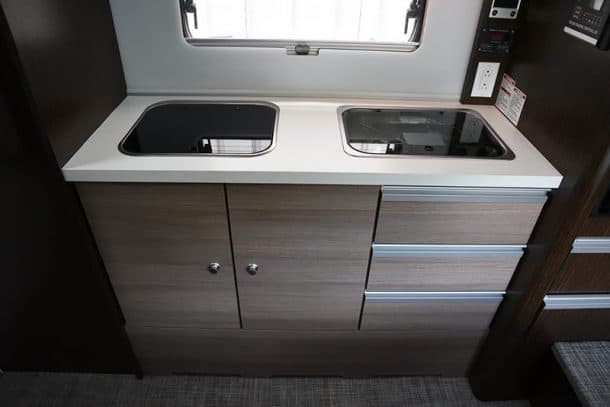
Locate an element on the screen. This screenshot has width=610, height=407. drawer (right) is located at coordinates (282, 218).